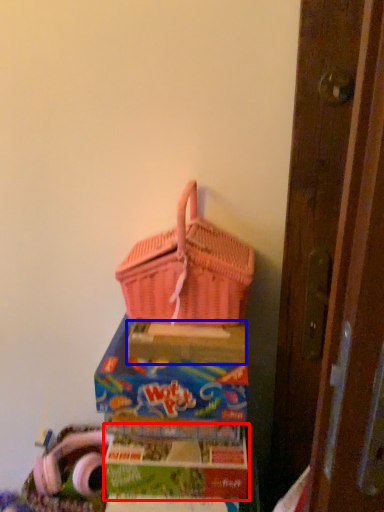
Question: Which point is closer to the camera, box (highlighted by a red box) or cardboard box (highlighted by a blue box)?

Choices:
 (A) box
 (B) cardboard box

Answer: (B)